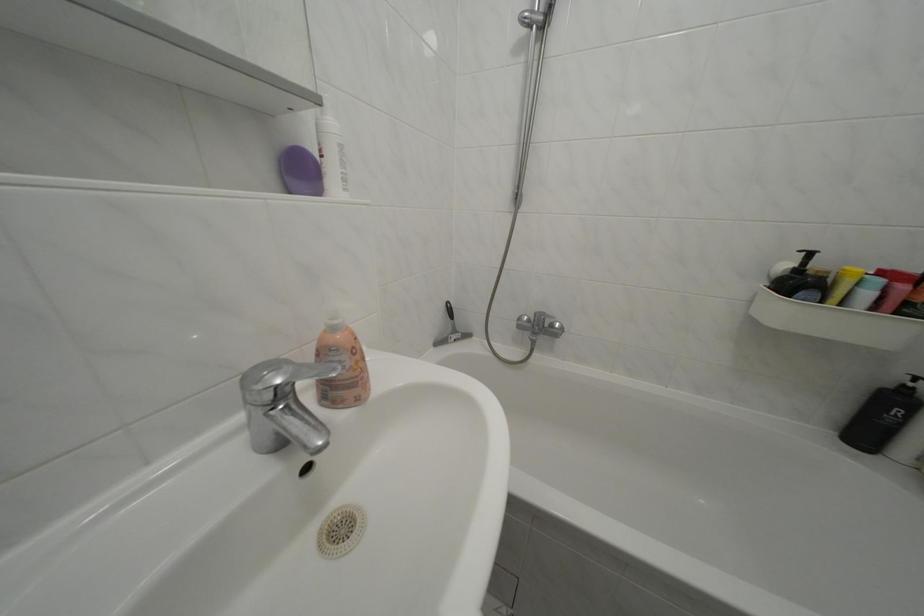
Image resolution: width=924 pixels, height=616 pixels. I want to click on yellow plastic tube, so click(x=843, y=284).